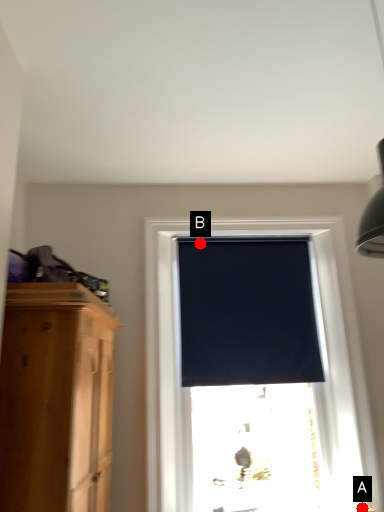
Question: Two points are circled on the image, labeled by A and B beside each circle. Which point is closer to the camera taking this photo?

Choices:
 (A) A is closer
 (B) B is closer

Answer: (A)